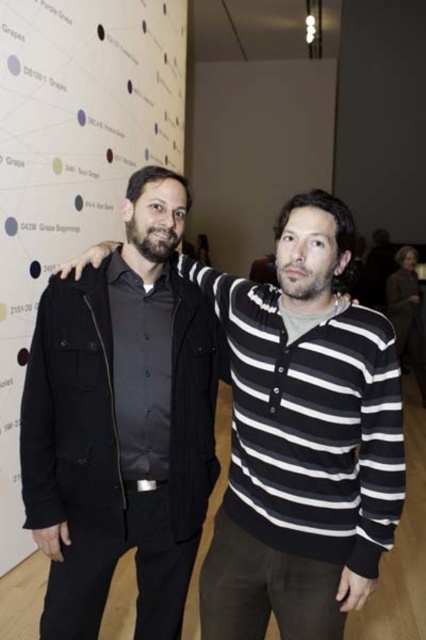
Question: Is black matte jacket at left to the right of white paperboard at upper left from the viewer's perspective?

Choices:
 (A) no
 (B) yes

Answer: (B)

Question: Which point is farther to the camera?

Choices:
 (A) white paperboard at upper left
 (B) black matte jacket at left

Answer: (A)

Question: Does black matte jacket at left have a greater width compared to white paperboard at upper left?

Choices:
 (A) no
 (B) yes

Answer: (B)

Question: Which of the following is the farthest from the observer?

Choices:
 (A) (267, 563)
 (B) (25, 125)

Answer: (B)

Question: Is black matte jacket at left to the right of white paperboard at upper left from the viewer's perspective?

Choices:
 (A) yes
 (B) no

Answer: (A)